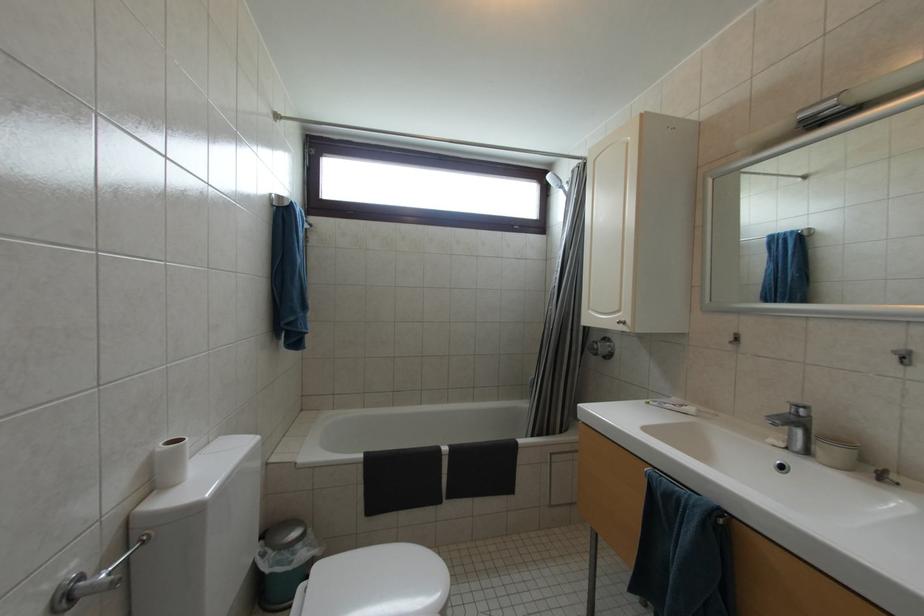
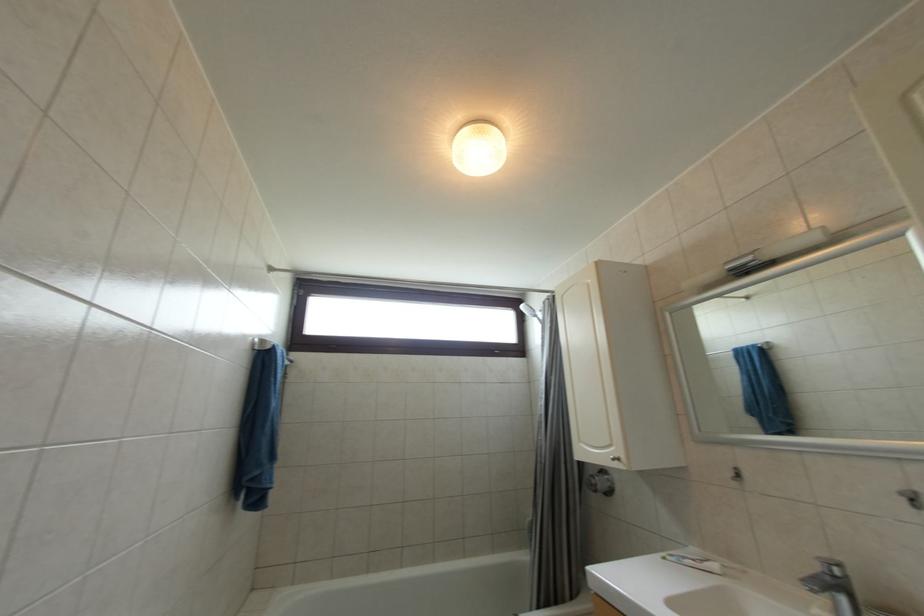
Question: The images are taken continuously from a first-person perspective. In which direction are you moving?

Choices:
 (A) Left
 (B) Right
 (C) Forward
 (D) Backward

Answer: (D)